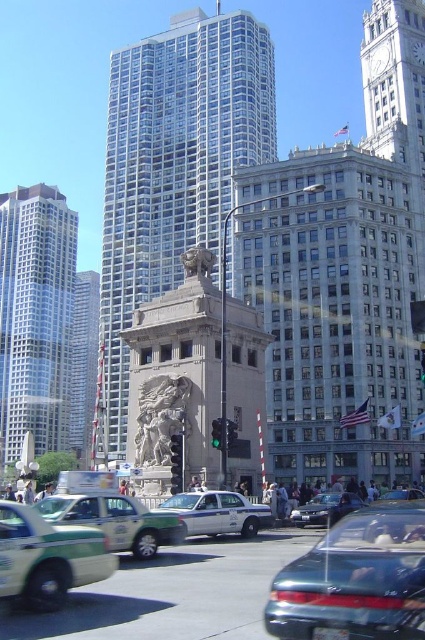
Looking at this image, you are standing at the camera position looking at the urban scene. There is a point marked at coordinates point (14, 349). Can you walk to that point from your current position?

The point (14, 349) is 532.78 feet away from the camera, so yes, you can walk to that point from your current position as it is within a reasonable walking distance.